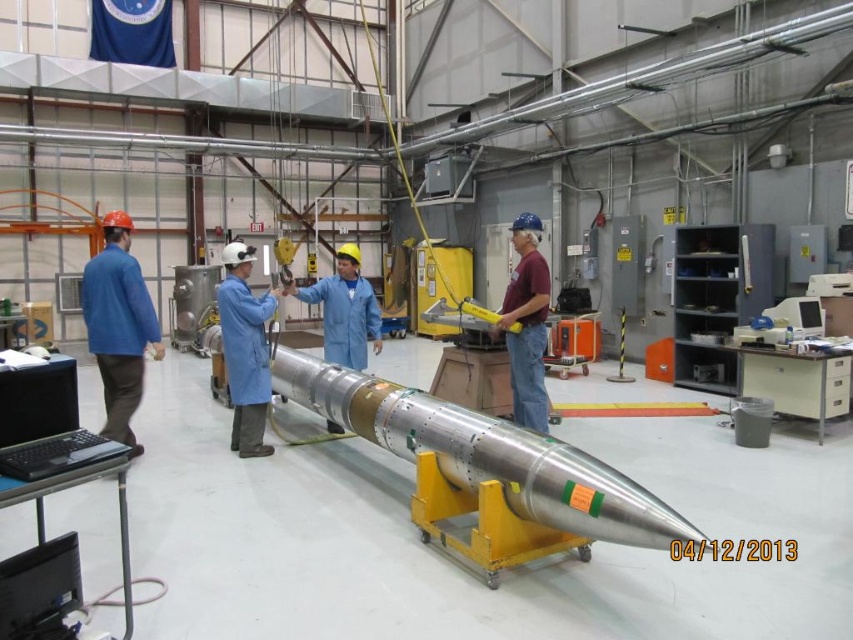
Question: Among these objects, which one is nearest to the camera?

Choices:
 (A) blue coverall at center
 (B) blue fabric coat at center
 (C) metallic silver rocket at center
 (D) blue fabric jacket at left

Answer: (C)

Question: Does blue fabric coat at center have a larger size compared to maroon fabric shirt at center?

Choices:
 (A) yes
 (B) no

Answer: (B)

Question: Considering the real-world distances, which object is closest to the blue fabric coat at center?

Choices:
 (A) metallic silver rocket at center
 (B) blue fabric jacket at left
 (C) blue coverall at center

Answer: (B)

Question: Does metallic silver rocket at center have a lesser width compared to blue fabric jacket at left?

Choices:
 (A) yes
 (B) no

Answer: (B)

Question: From the image, what is the correct spatial relationship of metallic silver rocket at center in relation to blue coverall at center?

Choices:
 (A) above
 (B) below

Answer: (B)

Question: Estimate the real-world distances between objects in this image. Which object is closer to the metallic silver rocket at center?

Choices:
 (A) blue coverall at center
 (B) blue fabric jacket at left

Answer: (A)